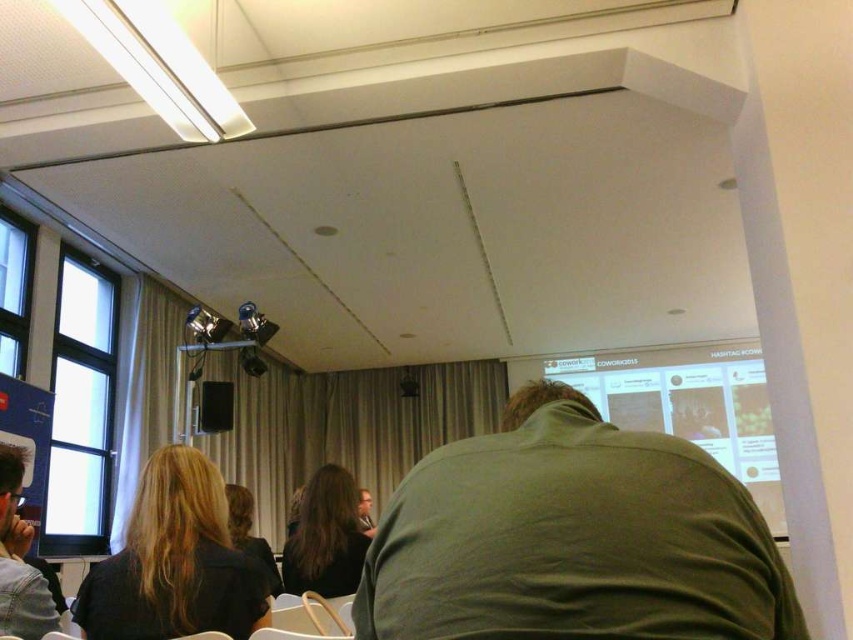
Question: Is dark brown hair at lower left smaller than black plastic speaker at center?

Choices:
 (A) no
 (B) yes

Answer: (A)

Question: Does dark brown hair at lower left come behind matte white projection screen at upper right?

Choices:
 (A) yes
 (B) no

Answer: (B)

Question: Is matte white projection screen at upper right positioned in front of matte black shirt at center?

Choices:
 (A) no
 (B) yes

Answer: (A)

Question: Which point appears closest to the camera in this image?

Choices:
 (A) (344, 547)
 (B) (218, 540)

Answer: (B)

Question: Among these objects, which one is nearest to the camera?

Choices:
 (A) green matte shirt at center
 (B) matte white projection screen at upper right
 (C) black plastic speaker at center
 (D) matte black jacket at lower left

Answer: (A)

Question: Which point is farther to the camera?

Choices:
 (A) matte white projection screen at upper right
 (B) matte black shirt at center

Answer: (A)